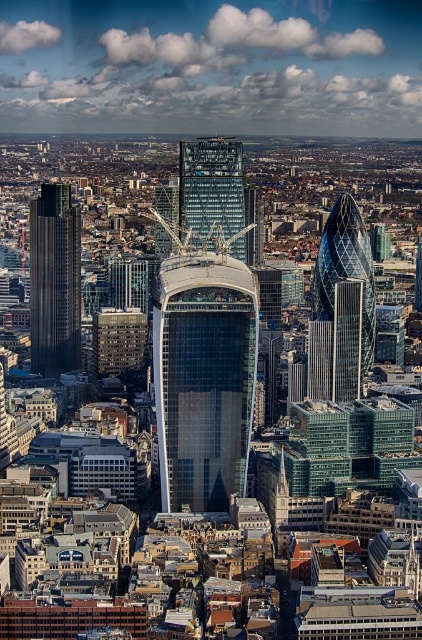
What do you see at coordinates (211, 188) in the screenshot?
I see `glassy reflective skyscraper at center` at bounding box center [211, 188].

This screenshot has height=640, width=422. Describe the element at coordinates (211, 188) in the screenshot. I see `glassy reflective skyscraper at center` at that location.

The height and width of the screenshot is (640, 422). What are the coordinates of `glassy reflective skyscraper at center` in the screenshot? It's located at (211, 188).

Is transparent glass skyscraper at center wider than glassy skyscraper at center?

Yes.

Is transparent glass skyscraper at center thinner than glassy skyscraper at center?

In fact, transparent glass skyscraper at center might be wider than glassy skyscraper at center.

Who is more forward, [238,273] or [168,204]?

Positioned in front is point [238,273].

Locate an element on the screen. This screenshot has width=422, height=640. transparent glass skyscraper at center is located at coordinates (203, 378).

Is transparent glass skyscraper at center above glassy reflective skyscraper at center?

No, transparent glass skyscraper at center is not above glassy reflective skyscraper at center.

Which is above, transparent glass skyscraper at center or glassy reflective skyscraper at center?

glassy reflective skyscraper at center

Is point (207, 426) behind point (192, 161)?

No, (207, 426) is in front of (192, 161).

You are a GUI agent. You are given a task and a screenshot of the screen. Output one action in this format:
    pyautogui.click(x=<x>, y=<y>)
    Task: Click on the transparent glass skyscraper at center
    This screenshot has height=640, width=422.
    Given the screenshot: What is the action you would take?
    pyautogui.click(x=203, y=378)